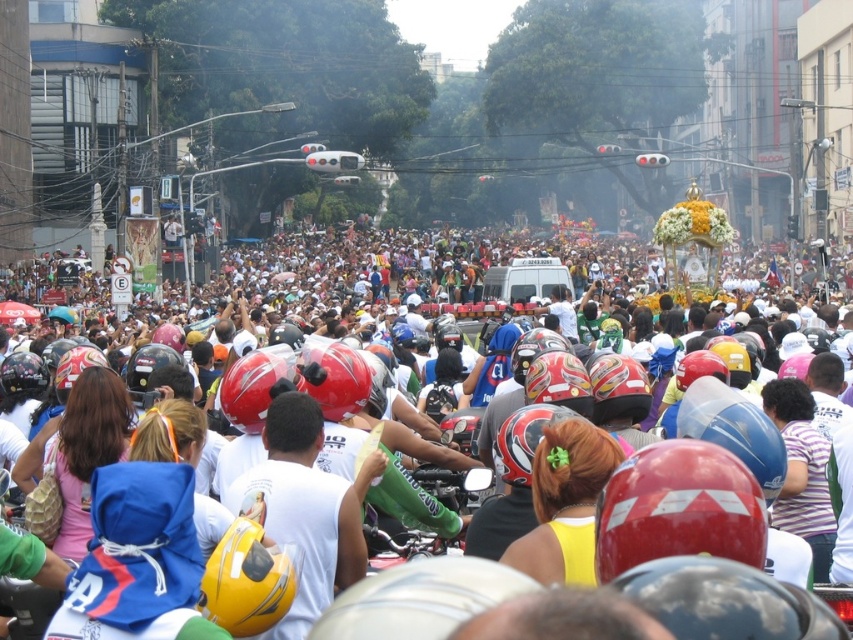
Question: Among these objects, which one is nearest to the camera?

Choices:
 (A) decorative float at center
 (B) glossy red helmet at center

Answer: (A)

Question: Can you confirm if decorative float at center is smaller than green matte motorcycle at center?

Choices:
 (A) yes
 (B) no

Answer: (B)

Question: Among these objects, which one is nearest to the camera?

Choices:
 (A) decorative float at center
 (B) white matte helmet at center
 (C) green matte motorcycle at center

Answer: (A)

Question: Which of these objects is positioned closest to the white matte helmet at center?

Choices:
 (A) glossy red helmet at center
 (B) decorative float at center

Answer: (A)

Question: Observing the image, what is the correct spatial positioning of decorative float at center in reference to green matte motorcycle at center?

Choices:
 (A) left
 (B) right

Answer: (A)

Question: Can you confirm if green matte motorcycle at center is positioned below glossy red helmet at center?

Choices:
 (A) no
 (B) yes

Answer: (B)